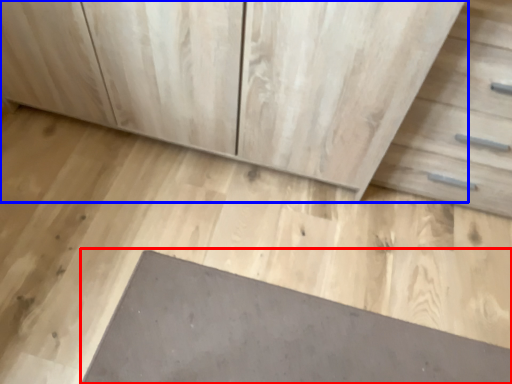
Question: Which point is further to the camera, slate (highlighted by a red box) or chest of drawers (highlighted by a blue box)?

Choices:
 (A) slate
 (B) chest of drawers

Answer: (A)